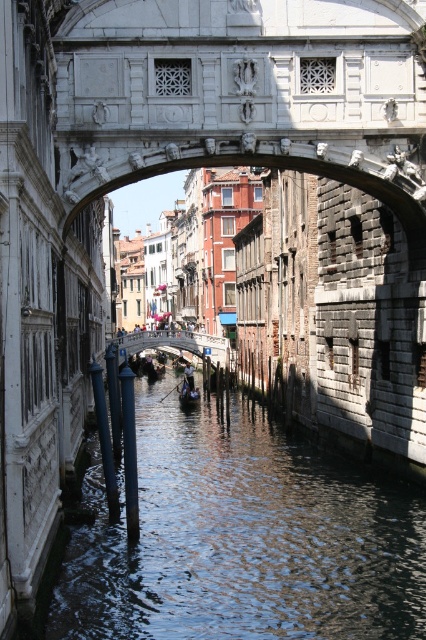
Consider the image. You are a tourist standing on the Bridge of Sighs and want to take a photo of the wooden gondola at center and the clear water at center. Which object should you focus on first to ensure both are in the frame?

You should focus on the wooden gondola at center first because the clear water at center is positioned under it, so adjusting the camera to include the gondola will naturally include the water beneath it.

You are standing at the Bridge of Sighs in Venice and want to take a photo of two specific points in the scene. The first point is at coordinates point (109, 509) and the second is at point (154, 378). Which point should you focus on first to ensure it appears larger in your photo?

Point (109, 509) is closer to the camera than point (154, 378), so focusing on point (109, 509) first will make it appear larger in the photo.

You are a tourist in Venice and want to take a photo of the smooth gray pole at lower center and the wooden gondola at center. Which object is wider?

The smooth gray pole at lower center is wider than the wooden gondola at center.